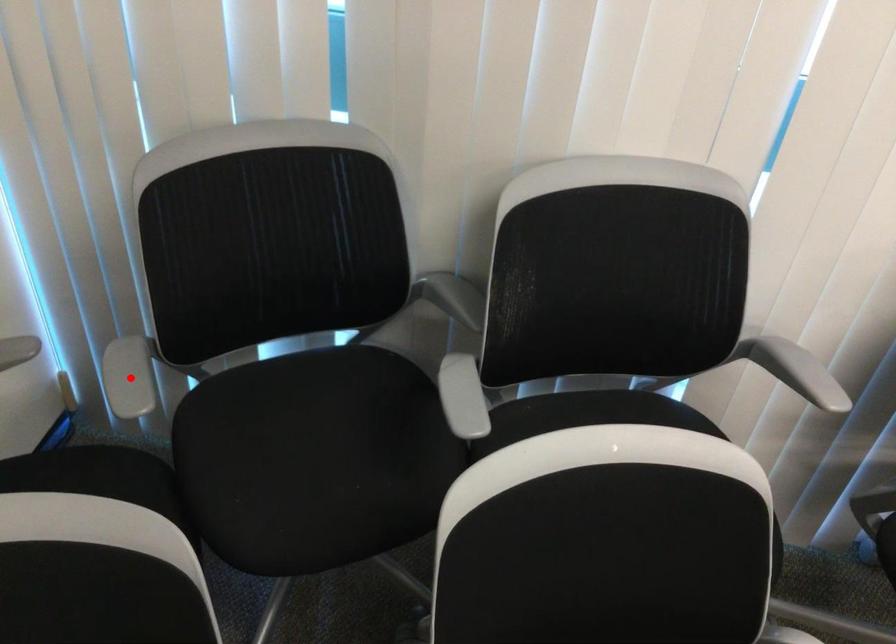
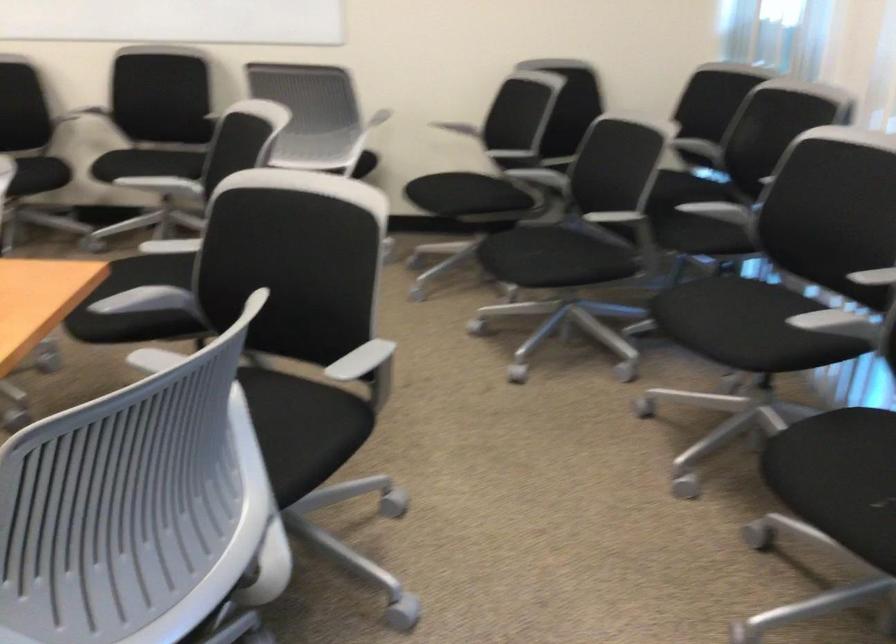
Question: I am providing you with two images of the same scene from different viewpoints. A red point is marked on the first image. Is the red point's position out of view in image 2?

Choices:
 (A) Yes
 (B) No

Answer: (A)